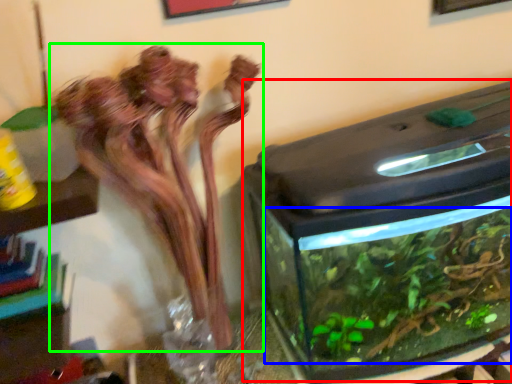
Question: Estimate the real-world distances between objects in this image. Which object is closer to water tank (highlighted by a red box), plant (highlighted by a blue box) or houseplant (highlighted by a green box)?

Choices:
 (A) plant
 (B) houseplant

Answer: (A)